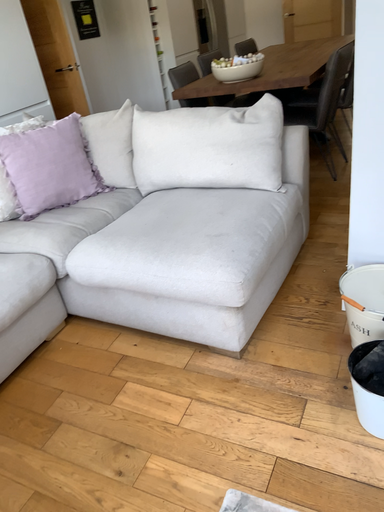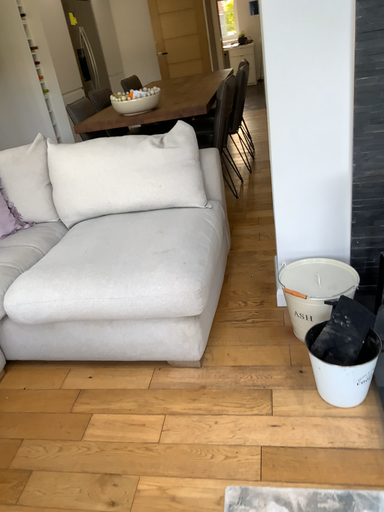
Question: Which way did the camera rotate in the video?

Choices:
 (A) rotated left
 (B) rotated right

Answer: (B)